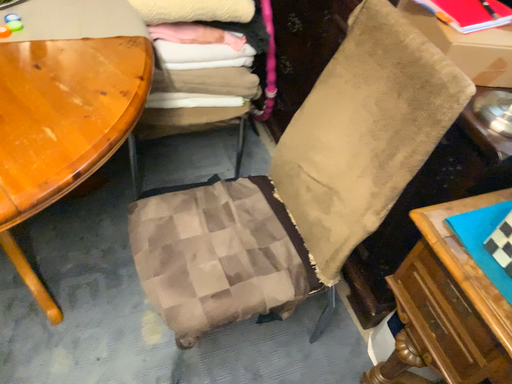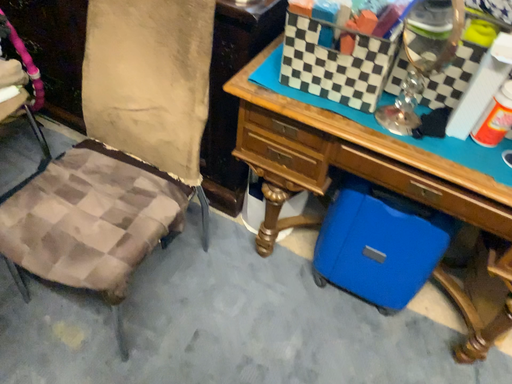
Question: How did the camera likely rotate when shooting the video?

Choices:
 (A) rotated left
 (B) rotated right

Answer: (B)